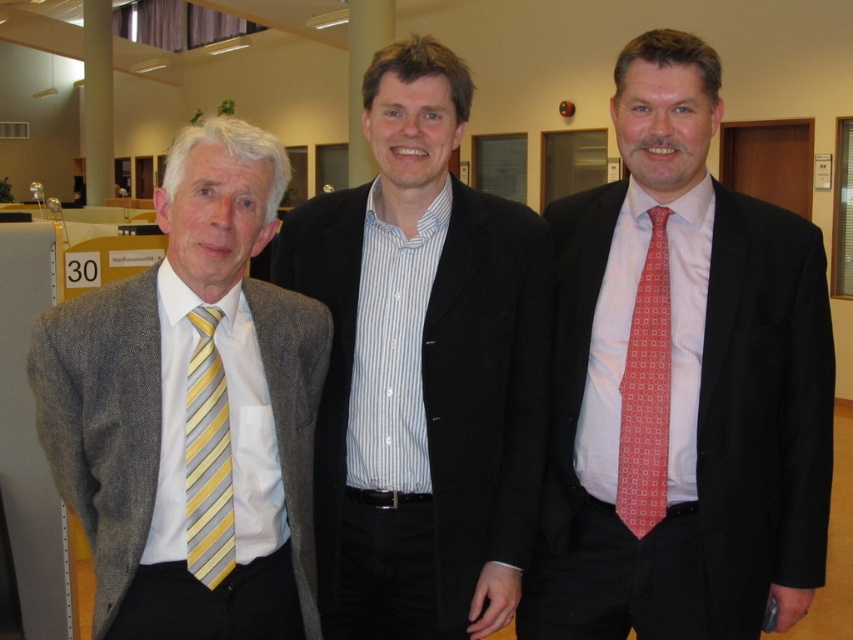
Question: Is gray herringbone blazer at left closer to the viewer compared to yellow striped tie at left?

Choices:
 (A) no
 (B) yes

Answer: (B)

Question: Is white striped shirt at center positioned in front of red silk tie at right?

Choices:
 (A) yes
 (B) no

Answer: (A)

Question: Which point is farther from the camera taking this photo?

Choices:
 (A) (618, 492)
 (B) (331, 548)
 (C) (227, 496)
 (D) (555, 212)

Answer: (D)

Question: Observing the image, what is the correct spatial positioning of matte black suit at center in reference to yellow striped tie at left?

Choices:
 (A) left
 (B) right

Answer: (B)

Question: Which of the following is the farthest from the observer?

Choices:
 (A) (624, 420)
 (B) (572, 273)

Answer: (B)

Question: Which point is farther from the camera taking this photo?

Choices:
 (A) (630, 401)
 (B) (587, 346)

Answer: (B)